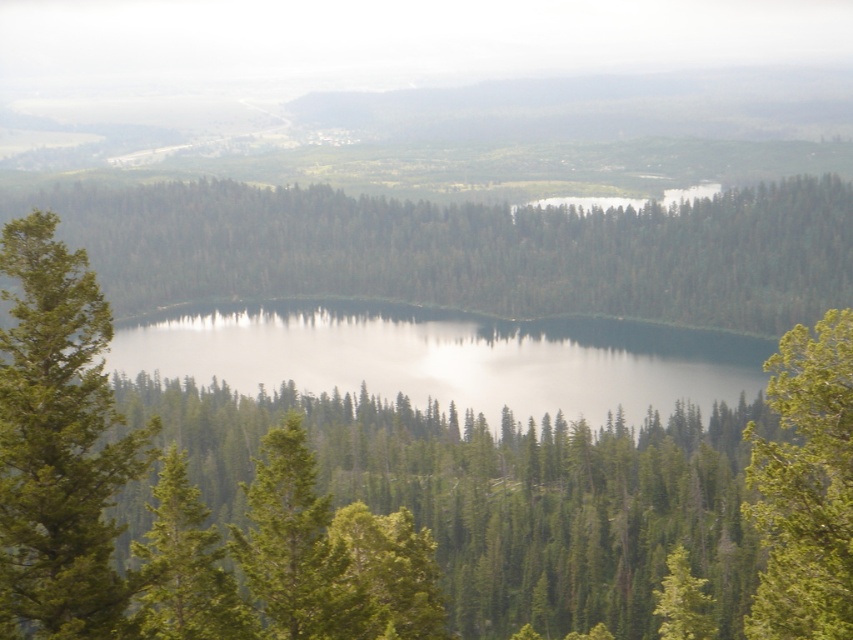
You are standing at the point labeled point (157, 342). If you look towards the viewer, what direction would you be facing?

Since the point (157, 342) is 170.54 meters away from the viewer, you would be facing away from the viewer if you are standing at that point and looking towards the direction opposite to the viewer.

You are standing at the edge of the forest looking towards the lake. You notice two trees in the scene. Which tree is closer to you, the green matte tree at center or the green leafy tree at right?

The green matte tree at center is closer to you because the green leafy tree at right is positioned behind it.

You are standing at the center of the scene and want to walk towards the green leafy tree at right. Which direction should you head?

The green leafy tree at right is located at point 0.762 on the x and 0.945 on the y, so you should head to the right and slightly upwards from your current position at the center to reach it.